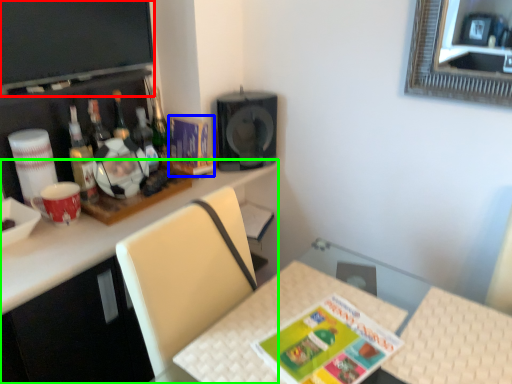
Question: Which object is positioned farthest from television (highlighted by a red box)? Select from magazine (highlighted by a blue box) and desk (highlighted by a green box).

Choices:
 (A) magazine
 (B) desk

Answer: (B)